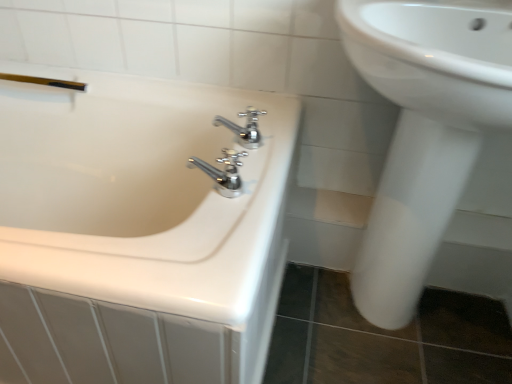
The image size is (512, 384). What do you see at coordinates (45, 81) in the screenshot? I see `gold metallic shower at upper left` at bounding box center [45, 81].

What do you see at coordinates (138, 192) in the screenshot? The height and width of the screenshot is (384, 512). I see `white glossy bathtub at left` at bounding box center [138, 192].

Image resolution: width=512 pixels, height=384 pixels. What do you see at coordinates (423, 132) in the screenshot?
I see `white glossy sink at right` at bounding box center [423, 132].

This screenshot has width=512, height=384. In order to click on chrome metallic faucet at center, which is counted as the second tap, starting from the back in this screenshot , I will do `click(223, 172)`.

From their relative heights in the image, would you say gold metallic shower at upper left is taller or shorter than white glossy bathtub at left?

Considering their sizes, gold metallic shower at upper left has less height than white glossy bathtub at left.

Image resolution: width=512 pixels, height=384 pixels. I want to click on shower above the white glossy bathtub at left (from a real-world perspective), so click(45, 81).

From the image's perspective, is gold metallic shower at upper left located beneath white glossy bathtub at left?

Actually, gold metallic shower at upper left appears above white glossy bathtub at left in the image.

Is gold metallic shower at upper left oriented towards white glossy bathtub at left?

Yes, gold metallic shower at upper left faces towards white glossy bathtub at left.

The width and height of the screenshot is (512, 384). I want to click on tap in front of the chrome metallic faucet at center, arranged as the first tap when viewed from the top, so click(223, 172).

Is chrome metallic faucet at center, which appears as the first tap when ordered from the bottom, in contact with chrome metallic faucet at center, arranged as the first tap when viewed from the top?

Yes, chrome metallic faucet at center, which appears as the first tap when ordered from the bottom, is in contact with chrome metallic faucet at center, arranged as the first tap when viewed from the top.

Locate an element on the screen. bathtub below the chrome metallic faucet at center, which appears as the first tap when ordered from the bottom (from a real-world perspective) is located at coordinates (138, 192).

Looking at this image, considering the relative sizes of white glossy bathtub at left and chrome metallic faucet at center, which appears as the first tap when ordered from the bottom, in the image provided, is white glossy bathtub at left thinner than chrome metallic faucet at center, which appears as the first tap when ordered from the bottom,?

No.

In the scene shown: Is white glossy bathtub at left further to the viewer compared to chrome metallic faucet at center, the first tap when ordered from front to back?

No.

Based on their sizes in the image, would you say gold metallic shower at upper left is bigger or smaller than white glossy sink at right?

In the image, gold metallic shower at upper left appears to be smaller than white glossy sink at right.

Locate an element on the screen. shower behind the white glossy sink at right is located at coordinates (45, 81).

Can you confirm if gold metallic shower at upper left is positioned to the right of white glossy sink at right?

In fact, gold metallic shower at upper left is to the left of white glossy sink at right.

Is gold metallic shower at upper left positioned before white glossy sink at right?

No, it is behind white glossy sink at right.

The width and height of the screenshot is (512, 384). What are the coordinates of `shower above the white glossy bathtub at left (from the image's perspective)` in the screenshot? It's located at (45, 81).

Is white glossy bathtub at left with gold metallic shower at upper left?

white glossy bathtub at left is not next to gold metallic shower at upper left, and they're not touching.

Which object is closer to the camera, white glossy bathtub at left or gold metallic shower at upper left?

white glossy bathtub at left is closer to the camera.

Which is closer, (449,44) or (242,132)?

Point (449,44).

From a real-world perspective, is white glossy sink at right over chrome metallic faucet at center, the 2th tap ordered from the bottom?

Incorrect, from a real-world perspective, white glossy sink at right is lower than chrome metallic faucet at center, the 2th tap ordered from the bottom.

Based on their sizes in the image, would you say white glossy sink at right is bigger or smaller than chrome metallic faucet at center, which ranks as the 2th tap in front-to-back order?

In the image, white glossy sink at right appears to be larger than chrome metallic faucet at center, which ranks as the 2th tap in front-to-back order.

Is white glossy sink at right taller than chrome metallic faucet at center, the 2th tap ordered from the bottom?

Correct, white glossy sink at right is much taller as chrome metallic faucet at center, the 2th tap ordered from the bottom.

From the image's perspective, count 2nd taps upward from the white glossy bathtub at left and point to it. Please provide its 2D coordinates.

[(244, 128)]

From a real-world perspective, between white glossy bathtub at left and chrome metallic faucet at center, the 2th tap ordered from the bottom, who is vertically higher?

In real-world perspective, chrome metallic faucet at center, the 2th tap ordered from the bottom, is above.

Consider the image. Does white glossy bathtub at left have a larger size compared to chrome metallic faucet at center, arranged as the first tap when viewed from the top?

Correct, white glossy bathtub at left is larger in size than chrome metallic faucet at center, arranged as the first tap when viewed from the top.

How many degrees apart are the facing directions of white glossy bathtub at left and chrome metallic faucet at center, arranged as the first tap when viewed from the top?

The facing directions of white glossy bathtub at left and chrome metallic faucet at center, arranged as the first tap when viewed from the top, are 90 degrees apart.

Identify the location of bathtub in front of the gold metallic shower at upper left. The height and width of the screenshot is (384, 512). (138, 192).

Locate an element on the screen. Image resolution: width=512 pixels, height=384 pixels. tap that appears below the chrome metallic faucet at center, arranged as the first tap when viewed from the top (from the image's perspective) is located at coordinates (223, 172).

Estimate the real-world distances between objects in this image. Which object is further from chrome metallic faucet at center, the first tap when ordered from front to back, chrome metallic faucet at center, arranged as the first tap when viewed from the top, or white glossy bathtub at left?

white glossy bathtub at left is further to chrome metallic faucet at center, the first tap when ordered from front to back.

Based on their spatial positions, is chrome metallic faucet at center, which ranks as the second tap in top-to-bottom order, or white glossy bathtub at left further from chrome metallic faucet at center, the 2th tap ordered from the bottom?

white glossy bathtub at left.

Looking at the image, which one is located closer to white glossy sink at right, chrome metallic faucet at center, which ranks as the 2th tap in front-to-back order, or white glossy bathtub at left?

The object closer to white glossy sink at right is chrome metallic faucet at center, which ranks as the 2th tap in front-to-back order.

Estimate the real-world distances between objects in this image. Which object is further from white glossy sink at right, white glossy bathtub at left or chrome metallic faucet at center, which ranks as the 2th tap in front-to-back order?

Based on the image, white glossy bathtub at left appears to be further to white glossy sink at right.

From the image, which object appears to be farther from chrome metallic faucet at center, arranged as the first tap when viewed from the top, white glossy bathtub at left or white glossy sink at right?

white glossy sink at right.

When comparing their distances from white glossy bathtub at left, does chrome metallic faucet at center, the first tap when ordered from front to back, or chrome metallic faucet at center, the 2th tap ordered from the bottom, seem further?

chrome metallic faucet at center, the 2th tap ordered from the bottom, is further to white glossy bathtub at left.

Estimate the real-world distances between objects in this image. Which object is further from gold metallic shower at upper left, white glossy bathtub at left or chrome metallic faucet at center, the 2th tap ordered from the bottom?

Among the two, chrome metallic faucet at center, the 2th tap ordered from the bottom, is located further to gold metallic shower at upper left.

Considering their positions, is gold metallic shower at upper left positioned closer to white glossy bathtub at left than chrome metallic faucet at center, which ranks as the 2th tap in front-to-back order?

The object closer to white glossy bathtub at left is chrome metallic faucet at center, which ranks as the 2th tap in front-to-back order.

Find the location of a particular element. Image resolution: width=512 pixels, height=384 pixels. bathtub situated between gold metallic shower at upper left and white glossy sink at right from left to right is located at coordinates (138, 192).

This screenshot has height=384, width=512. Find the location of `tap between gold metallic shower at upper left and chrome metallic faucet at center, acting as the first tap starting from the back, from left to right`. tap between gold metallic shower at upper left and chrome metallic faucet at center, acting as the first tap starting from the back, from left to right is located at coordinates (223, 172).

I want to click on bathtub between gold metallic shower at upper left and chrome metallic faucet at center, the 2th tap ordered from the bottom, so click(x=138, y=192).

What are the coordinates of `tap between white glossy bathtub at left and chrome metallic faucet at center, which ranks as the 2th tap in front-to-back order, from left to right` in the screenshot? It's located at (223, 172).